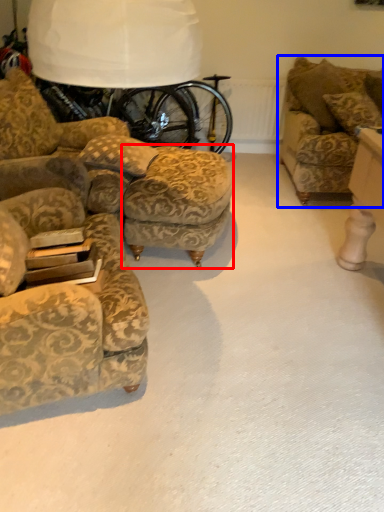
Question: Among these objects, which one is nearest to the camera, stool (highlighted by a red box) or studio couch (highlighted by a blue box)?

Choices:
 (A) stool
 (B) studio couch

Answer: (A)